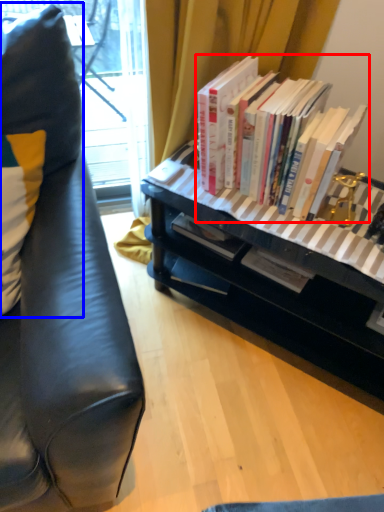
Question: Which point is closer to the camera, book (highlighted by a red box) or pillow (highlighted by a blue box)?

Choices:
 (A) book
 (B) pillow

Answer: (B)